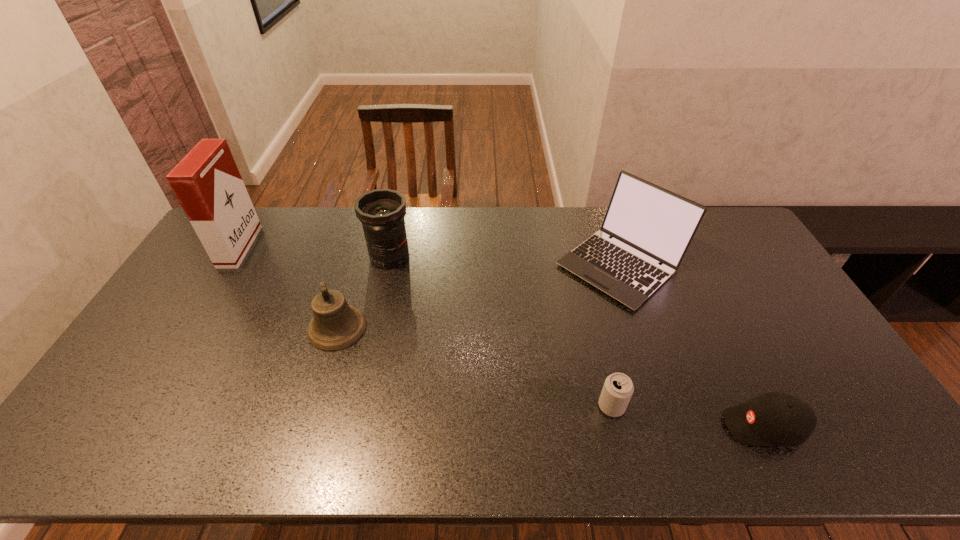
I want to click on the tallest object, so click(x=207, y=183).

Find the location of a particular element. Image resolution: width=960 pixels, height=540 pixels. the leftmost object is located at coordinates (207, 183).

Where is `laptop_computer`? laptop_computer is located at coordinates (649, 225).

Locate an element on the screen. This screenshot has width=960, height=540. telephoto lens is located at coordinates (381, 211).

Identify the location of the third shortest object. (336, 325).

You are a GUI agent. You are given a task and a screenshot of the screen. Output one action in this format:
    pyautogui.click(x=<x>, y=<y>)
    Task: Click on the can
    The image size is (960, 540).
    Given the screenshot: What is the action you would take?
    (x=618, y=388)

The height and width of the screenshot is (540, 960). What are the coordinates of `baseball cap` in the screenshot? It's located at (776, 418).

Find the location of a particular element. This screenshot has height=540, width=960. free space located 0.390m on the front-facing side of the leftmost object is located at coordinates (361, 247).

You are a GUI agent. You are given a task and a screenshot of the screen. Output one action in this format:
    pyautogui.click(x=<x>, y=<y>)
    Task: Click on the free space located at the front screen of the laptop_computer
    The height and width of the screenshot is (540, 960).
    Given the screenshot: What is the action you would take?
    pyautogui.click(x=496, y=266)

At what (x,y) coordinates should I click in order to perform the action: click on blank space located at the front screen of the laptop_computer. Please return your answer as a coordinate pair (x, y). This screenshot has height=540, width=960. Looking at the image, I should click on (538, 266).